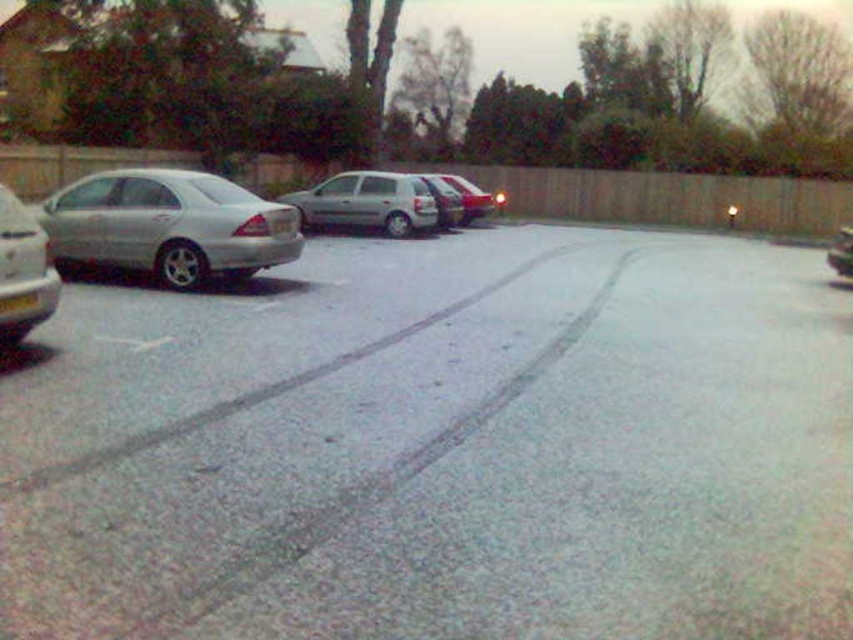
Question: Which point is farther to the camera?

Choices:
 (A) (428, 179)
 (B) (834, 268)

Answer: (A)

Question: Is satin silver sedan at left further to the viewer compared to satin silver hatchback at center?

Choices:
 (A) no
 (B) yes

Answer: (A)

Question: Is satin silver sedan at left below satin silver hatchback at center?

Choices:
 (A) no
 (B) yes

Answer: (B)

Question: Which of these objects is positioned farthest from the silver metallic car at left?

Choices:
 (A) satin silver sedan at center
 (B) satin silver hatchback at center

Answer: (A)

Question: Can you confirm if satin silver sedan at left is positioned above metallic silver sedan at center?

Choices:
 (A) yes
 (B) no

Answer: (B)

Question: Which point is farther to the camera?

Choices:
 (A) satin silver sedan at center
 (B) satin silver sedan at left

Answer: (A)